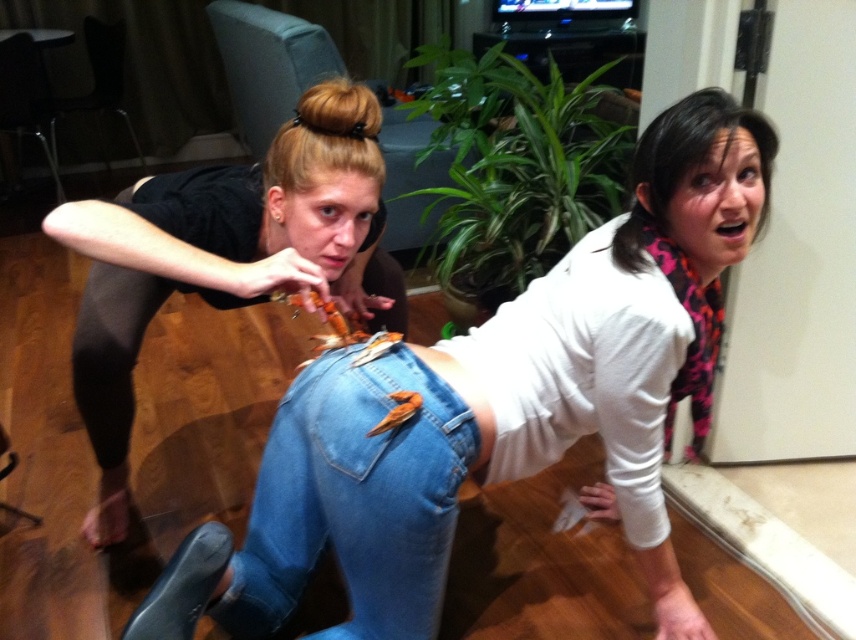
Question: Observing the image, what is the correct spatial positioning of denim jeans at lower center in reference to denim at lower center?

Choices:
 (A) above
 (B) below

Answer: (A)

Question: Which object appears farthest from the camera in this image?

Choices:
 (A) denim at lower center
 (B) denim jeans at lower center

Answer: (A)

Question: Is denim jeans at lower center positioned in front of denim at lower center?

Choices:
 (A) yes
 (B) no

Answer: (A)

Question: Which of the following is the closest to the observer?

Choices:
 (A) (288, 435)
 (B) (492, 333)

Answer: (A)

Question: Can you confirm if denim jeans at lower center is smaller than denim at lower center?

Choices:
 (A) no
 (B) yes

Answer: (A)